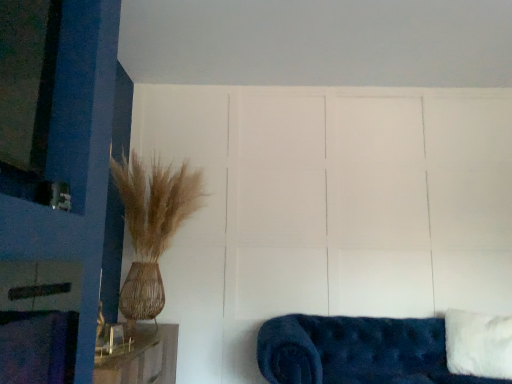
In order to face white fluffy pillow at lower right, should I rotate leftwards or rightwards?

To align with it, rotate right about 26.950°.

Image resolution: width=512 pixels, height=384 pixels. Describe the element at coordinates (478, 344) in the screenshot. I see `white fluffy pillow at lower right` at that location.

This screenshot has width=512, height=384. Identify the location of white fluffy pillow at lower right. (478, 344).

Measure the distance between velvet blue couch at lower right and camera.

1.93 meters.

The width and height of the screenshot is (512, 384). Describe the element at coordinates (356, 351) in the screenshot. I see `velvet blue couch at lower right` at that location.

I want to click on velvet blue couch at lower right, so click(x=356, y=351).

In the scene shown: What is the approximate height of velvet blue couch at lower right?

velvet blue couch at lower right is 47.84 centimeters in height.

The image size is (512, 384). In order to click on white fluffy pillow at lower right in this screenshot , I will do `click(478, 344)`.

Is velvet blue couch at lower right to the left of white fluffy pillow at lower right from the viewer's perspective?

Yes, velvet blue couch at lower right is to the left of white fluffy pillow at lower right.

Is velvet blue couch at lower right behind white fluffy pillow at lower right?

No, velvet blue couch at lower right is in front of white fluffy pillow at lower right.

Is point (273, 363) closer or farther from the camera than point (501, 342)?

Point (273, 363).

From the image's perspective, would you say velvet blue couch at lower right is shown under white fluffy pillow at lower right?

Correct, velvet blue couch at lower right appears lower than white fluffy pillow at lower right in the image.

From a real-world perspective, is velvet blue couch at lower right physically located above or below white fluffy pillow at lower right?

In terms of real-world spatial position, velvet blue couch at lower right is below white fluffy pillow at lower right.

Considering the sizes of velvet blue couch at lower right and white fluffy pillow at lower right in the image, is velvet blue couch at lower right wider or thinner than white fluffy pillow at lower right?

velvet blue couch at lower right is wider than white fluffy pillow at lower right.

Based on the photo, does velvet blue couch at lower right have a greater height compared to white fluffy pillow at lower right?

No, velvet blue couch at lower right is not taller than white fluffy pillow at lower right.

Which of these two, velvet blue couch at lower right or white fluffy pillow at lower right, is smaller?

With smaller size is white fluffy pillow at lower right.

Is velvet blue couch at lower right spatially inside white fluffy pillow at lower right, or outside of it?

velvet blue couch at lower right lies outside white fluffy pillow at lower right.

Are velvet blue couch at lower right and white fluffy pillow at lower right making contact?

No.

Is velvet blue couch at lower right oriented away from white fluffy pillow at lower right?

Yes, velvet blue couch at lower right is positioned with its back facing white fluffy pillow at lower right.

Locate an element on the screen. This screenshot has width=512, height=384. pillow that is above the velvet blue couch at lower right (from a real-world perspective) is located at coordinates (478, 344).

Is white fluffy pillow at lower right to the right of velvet blue couch at lower right from the viewer's perspective?

Indeed, white fluffy pillow at lower right is positioned on the right side of velvet blue couch at lower right.

Considering the relative positions of white fluffy pillow at lower right and velvet blue couch at lower right in the image provided, is white fluffy pillow at lower right behind velvet blue couch at lower right?

Yes, it is behind velvet blue couch at lower right.

Which is in front, point (477, 368) or point (328, 337)?

The point (477, 368) is in front.

Looking at this image, from the image's perspective, is white fluffy pillow at lower right under velvet blue couch at lower right?

No, from the image's perspective, white fluffy pillow at lower right is not beneath velvet blue couch at lower right.

From a real-world perspective, who is located lower, white fluffy pillow at lower right or velvet blue couch at lower right?

From a 3D spatial view, velvet blue couch at lower right is below.

In terms of width, does white fluffy pillow at lower right look wider or thinner when compared to velvet blue couch at lower right?

white fluffy pillow at lower right is thinner than velvet blue couch at lower right.

Considering the sizes of objects white fluffy pillow at lower right and velvet blue couch at lower right in the image provided, who is shorter, white fluffy pillow at lower right or velvet blue couch at lower right?

velvet blue couch at lower right.

Looking at the image, does white fluffy pillow at lower right seem bigger or smaller compared to velvet blue couch at lower right?

In the image, white fluffy pillow at lower right appears to be smaller than velvet blue couch at lower right.

Is velvet blue couch at lower right located within white fluffy pillow at lower right?

Actually, velvet blue couch at lower right is outside white fluffy pillow at lower right.

Is white fluffy pillow at lower right far from velvet blue couch at lower right?

They are positioned close to each other.

Is white fluffy pillow at lower right oriented away from velvet blue couch at lower right?

Yes, white fluffy pillow at lower right is facing away from velvet blue couch at lower right.

Locate an element on the screen. The width and height of the screenshot is (512, 384). studio couch located on the left of white fluffy pillow at lower right is located at coordinates (356, 351).

The width and height of the screenshot is (512, 384). In order to click on studio couch located underneath the white fluffy pillow at lower right (from a real-world perspective) in this screenshot , I will do `click(356, 351)`.

At what (x,y) coordinates should I click in order to perform the action: click on studio couch on the left of the white fluffy pillow at lower right. Please return your answer as a coordinate pair (x, y). This screenshot has height=384, width=512. Looking at the image, I should click on (356, 351).